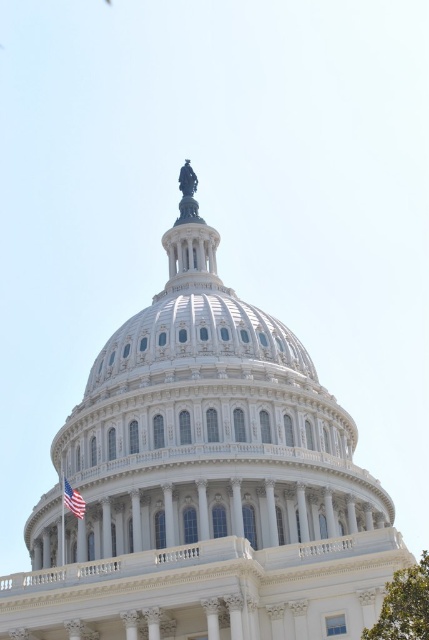
Locate an element on the screen. white marble dome at center is located at coordinates (202, 428).

Does white marble dome at center have a greater width compared to green leafy tree at lower right?

No, white marble dome at center is not wider than green leafy tree at lower right.

Who is more forward, (x=126, y=412) or (x=428, y=554)?

Point (x=126, y=412) is more forward.

You are a GUI agent. You are given a task and a screenshot of the screen. Output one action in this format:
    pyautogui.click(x=<x>, y=<y>)
    Task: Click on the white marble dome at center
    The height and width of the screenshot is (640, 429).
    Given the screenshot: What is the action you would take?
    pyautogui.click(x=202, y=428)

Is green leafy tree at lower right positioned in front of american flag at lower left?

Yes, it is.

Identify the location of green leafy tree at lower right. This screenshot has width=429, height=640. (404, 604).

Does white marble dome at center come in front of american flag at lower left?

Yes.

Between point (112, 531) and point (75, 516), which one is positioned behind?

Point (112, 531)

Between point (392, 522) and point (82, 516), which one is positioned in front?

Point (82, 516)

In order to click on white marble dome at center in this screenshot , I will do `click(202, 428)`.